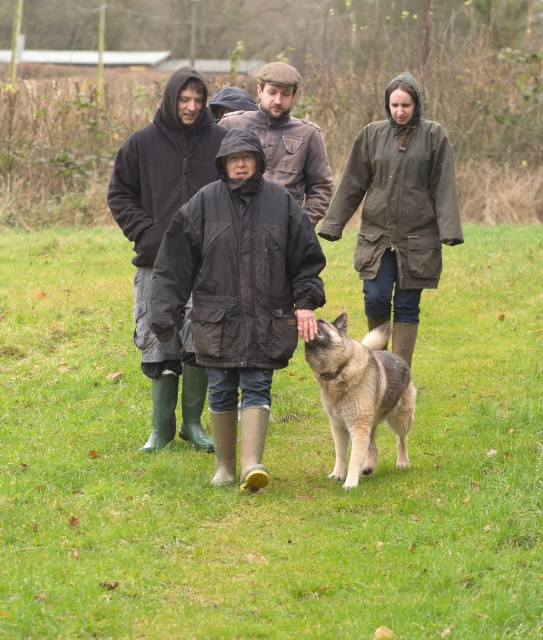
You are a photographer trying to capture both the dark matte jacket at center and the brown leather jacket at center in the same frame. Based on their positions, which jacket should you focus on first to ensure both are in the shot?

The dark matte jacket at center is located below the brown leather jacket at center, so you should focus on the brown leather jacket at center first to ensure both are in the shot.